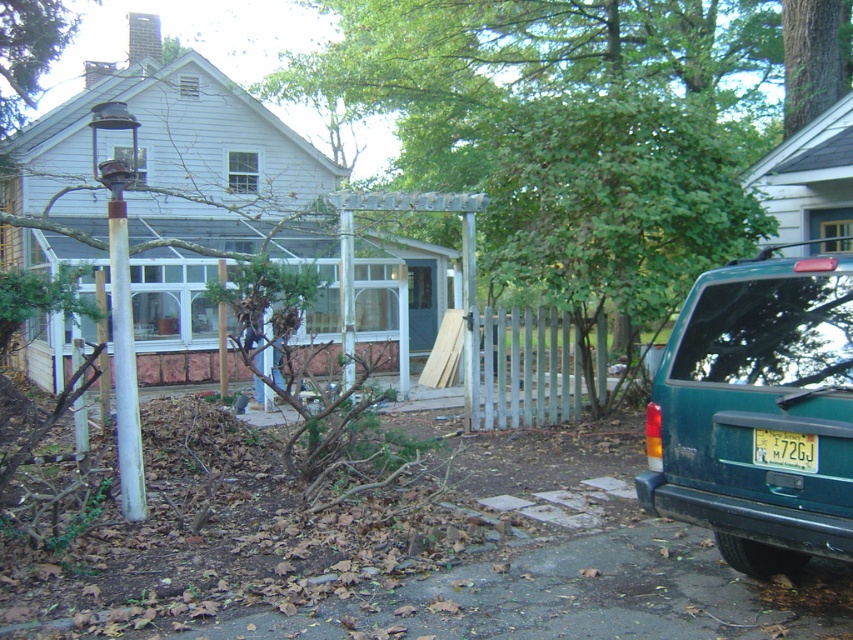
You are standing at the front door of the house. You see a point marked at coordinates (756, 412). What object is located at that point?

The point at coordinates (756, 412) corresponds to the teal matte suv at lower right.

You are a delivery person approaching the house and need to park your vehicle. There is a driveway, but you notice the green leafy tree at center and the yellow matte license plate at lower right. Which object should you avoid hitting while parking?

You should avoid hitting the green leafy tree at center because it has a larger size compared to the yellow matte license plate at lower right, making it more likely to cause damage if struck.

You are a delivery driver who needs to park your teal matte suv at lower right in a spot that requires a vehicle height clearance of 6 feet. You see the yellow matte license plate at lower right. Can you determine if your suv will fit under the clearance based on the license plate?

The teal matte suv at lower right is taller than the yellow matte license plate at lower right. Since the license plate is typically mounted at the bottom of the vehicle, this suggests the SUV is taller than the license plate. However, without knowing the exact height of the license plate, it is uncertain if the SUV exceeds the 6 feet clearance. Further measurements are needed.